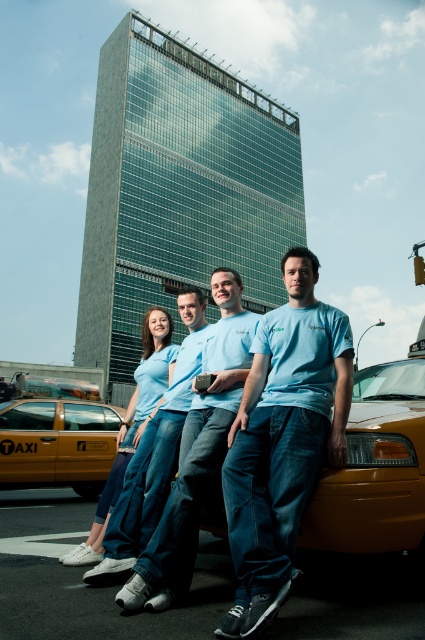
The width and height of the screenshot is (425, 640). What do you see at coordinates (283, 440) in the screenshot?
I see `light blue cotton t-shirt at center` at bounding box center [283, 440].

Find the location of a particular element. The width and height of the screenshot is (425, 640). light blue cotton t-shirt at center is located at coordinates (283, 440).

Who is higher up, matte yellow taxi cab at center or yellow taxi cab at lower left?

matte yellow taxi cab at center is higher up.

Who is positioned more to the right, matte yellow taxi cab at center or yellow taxi cab at lower left?

matte yellow taxi cab at center

Image resolution: width=425 pixels, height=640 pixels. Describe the element at coordinates (376, 467) in the screenshot. I see `matte yellow taxi cab at center` at that location.

Locate an element on the screen. This screenshot has width=425, height=640. matte yellow taxi cab at center is located at coordinates (376, 467).

Does light blue cotton t-shirt at center have a lesser height compared to light blue denim jeans at center?

Yes, light blue cotton t-shirt at center is shorter than light blue denim jeans at center.

Is light blue cotton t-shirt at center taller than light blue denim jeans at center?

Incorrect, light blue cotton t-shirt at center's height is not larger of light blue denim jeans at center's.

Find the location of `light blue cotton t-shirt at center`. light blue cotton t-shirt at center is located at coordinates (283, 440).